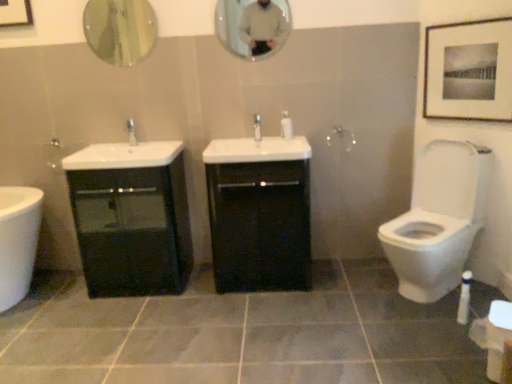
You are a GUI agent. You are given a task and a screenshot of the screen. Output one action in this format:
    pyautogui.click(x=<x>, y=<y>)
    Task: Click on the free space in front of white glossy toilet at right
    The width and height of the screenshot is (512, 384).
    Given the screenshot: What is the action you would take?
    pyautogui.click(x=425, y=334)